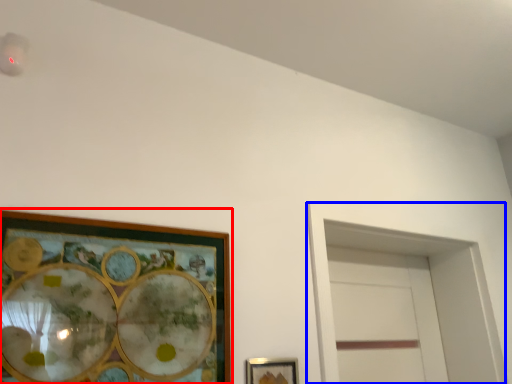
Question: Which object appears farthest to the camera in this image, picture frame (highlighted by a red box) or glass door (highlighted by a blue box)?

Choices:
 (A) picture frame
 (B) glass door

Answer: (B)